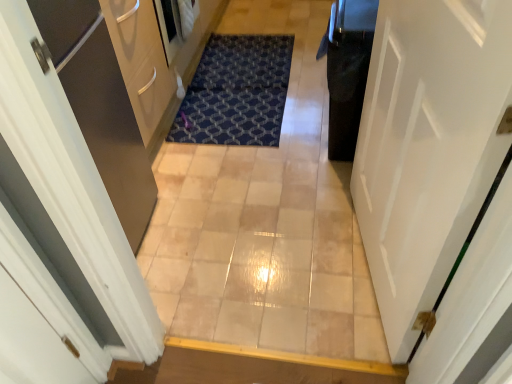
Where is `free space to the back side of white glossy door at right`? The image size is (512, 384). free space to the back side of white glossy door at right is located at coordinates (306, 195).